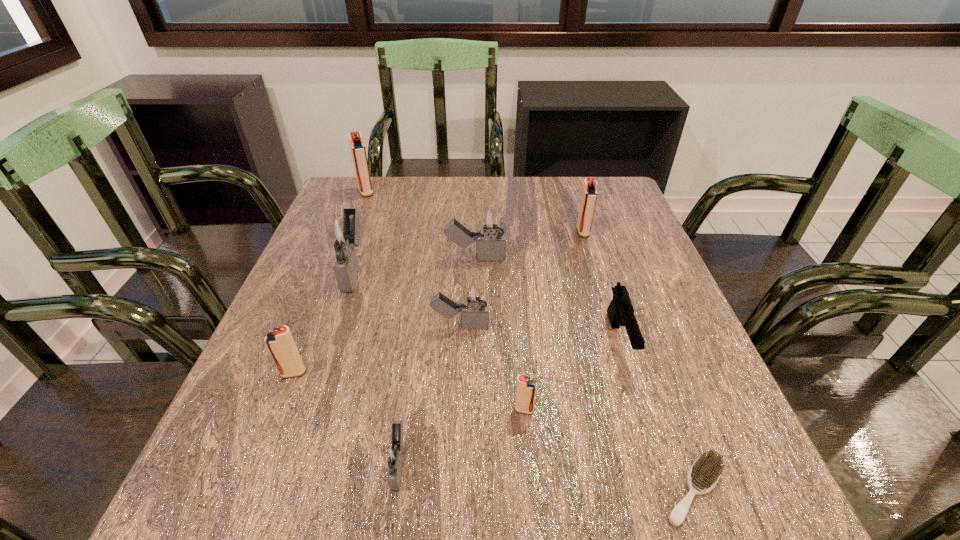
Identify the location of vacant space located 0.330m on the back of the second nearest gray igniter. The width and height of the screenshot is (960, 540). (465, 226).

Where is `vacant space located 0.190m on the front of the third farthest red igniter`? This screenshot has width=960, height=540. vacant space located 0.190m on the front of the third farthest red igniter is located at coordinates (251, 483).

Identify the location of vacant point located on the front-facing side of the pistol. (666, 491).

Locate an element on the screen. vacant area situated on the left of the second nearest igniter is located at coordinates (289, 409).

Locate an element on the screen. Image resolution: width=960 pixels, height=540 pixels. free space located 0.140m on the left of the seventh object from right to left is located at coordinates (295, 463).

Find the location of a particular element. Image resolution: width=960 pixels, height=540 pixels. free location located 0.320m on the back of the scrubbing brush is located at coordinates (631, 312).

Find the location of `object situated at the far edge`. object situated at the far edge is located at coordinates [358, 150].

Find the location of a particular element. The width and height of the screenshot is (960, 540). igniter that is at the near edge is located at coordinates (x=395, y=456).

Identify the location of scrubbing brush present at the near edge. This screenshot has width=960, height=540. (705, 472).

You are a GUI agent. You are given a task and a screenshot of the screen. Output one action in this format:
    pyautogui.click(x=<x>, y=<y>)
    Task: Click on the igniter present at the right edge
    This screenshot has width=960, height=540.
    Given the screenshot: What is the action you would take?
    pyautogui.click(x=589, y=194)